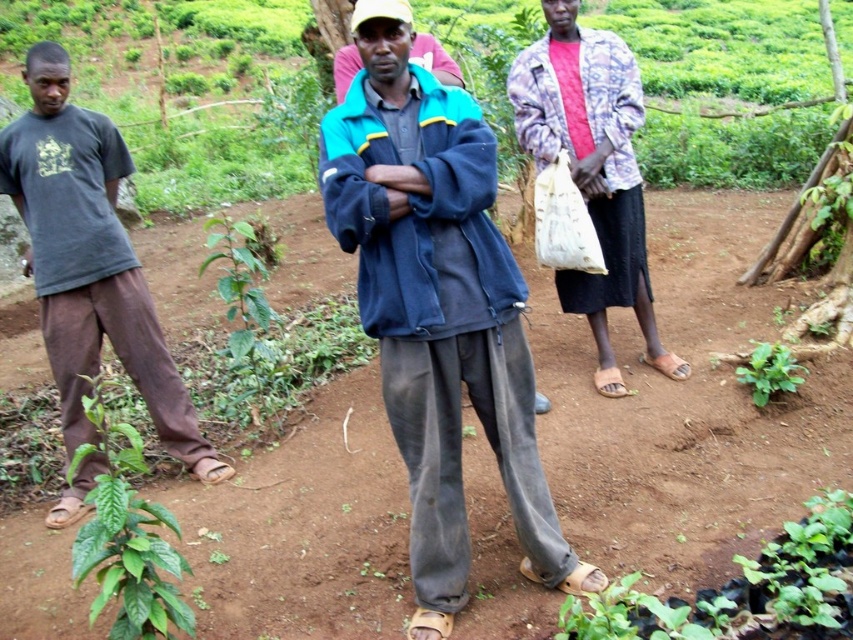
Looking at this image, between brown soil at center and dark gray t-shirt at left, which one has less height?

brown soil at center

Can you confirm if brown soil at center is positioned above dark gray t-shirt at left?

Incorrect, brown soil at center is not positioned above dark gray t-shirt at left.

What do you see at coordinates (686, 404) in the screenshot? The width and height of the screenshot is (853, 640). I see `brown soil at center` at bounding box center [686, 404].

At what (x,y) coordinates should I click in order to perform the action: click on brown soil at center. Please return your answer as a coordinate pair (x, y). The width and height of the screenshot is (853, 640). Looking at the image, I should click on (686, 404).

Between point (492, 195) and point (90, 211), which one is positioned in front?

Positioned in front is point (492, 195).

Does point (433, 195) come in front of point (51, 164)?

Yes, it is in front of point (51, 164).

Does point (503, 412) come in front of point (28, 141)?

Yes, point (503, 412) is in front of point (28, 141).

At what (x,y) coordinates should I click in order to perform the action: click on dark blue fleece jacket at center. Please return your answer as a coordinate pair (x, y). Looking at the image, I should click on (438, 307).

Can you confirm if brown soil at center is shorter than dark blue fleece jacket at center?

Yes, brown soil at center is shorter than dark blue fleece jacket at center.

From the picture: Does brown soil at center have a smaller size compared to dark blue fleece jacket at center?

Indeed, brown soil at center has a smaller size compared to dark blue fleece jacket at center.

Which is in front, point (355, 630) or point (416, 556)?

Point (416, 556) is in front.

Where is `brown soil at center`? This screenshot has width=853, height=640. brown soil at center is located at coordinates (686, 404).